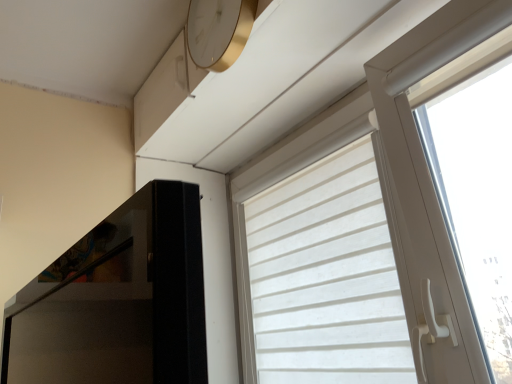
What do you see at coordinates (391, 182) in the screenshot? I see `white matte window at upper right` at bounding box center [391, 182].

What do you see at coordinates (326, 277) in the screenshot? The image size is (512, 384). I see `white fabric curtain at upper right` at bounding box center [326, 277].

The height and width of the screenshot is (384, 512). In order to click on white matte window at upper right in this screenshot , I will do `click(391, 182)`.

From a real-world perspective, is white fabric curtain at upper right on gold metallic clock at upper center?

No, from a real-world perspective, white fabric curtain at upper right is not above gold metallic clock at upper center.

Is white fabric curtain at upper right at the right side of gold metallic clock at upper center?

Correct, you'll find white fabric curtain at upper right to the right of gold metallic clock at upper center.

Which point is more forward, (x=386, y=358) or (x=197, y=61)?

The point (x=386, y=358) is in front.

Considering the sizes of objects gold metallic clock at upper center and white matte window at upper right in the image provided, who is smaller, gold metallic clock at upper center or white matte window at upper right?

Smaller between the two is gold metallic clock at upper center.

Considering the positions of objects gold metallic clock at upper center and white matte window at upper right in the image provided, who is more to the right, gold metallic clock at upper center or white matte window at upper right?

From the viewer's perspective, white matte window at upper right appears more on the right side.

Consider the image. Is gold metallic clock at upper center oriented away from white matte window at upper right?

gold metallic clock at upper center is not turned away from white matte window at upper right.

Is gold metallic clock at upper center in front of or behind white matte window at upper right in the image?

Clearly, gold metallic clock at upper center is behind white matte window at upper right.

Could you tell me if white matte window at upper right is facing white fabric curtain at upper right?

Yes, white matte window at upper right is aimed at white fabric curtain at upper right.

Considering the points (441, 90) and (373, 308), which point is in front, point (441, 90) or point (373, 308)?

Point (441, 90)

Between white matte window at upper right and white fabric curtain at upper right, which one has larger width?

white matte window at upper right is wider.

Does white matte window at upper right have a lesser height compared to white fabric curtain at upper right?

Incorrect, the height of white matte window at upper right does not fall short of that of white fabric curtain at upper right.

Is white fabric curtain at upper right positioned beyond the bounds of white matte window at upper right?

No, white fabric curtain at upper right is not entirely external to white matte window at upper right.

Looking at the image, does white fabric curtain at upper right seem bigger or smaller compared to white matte window at upper right?

white fabric curtain at upper right is smaller than white matte window at upper right.

Based on the photo, is white fabric curtain at upper right next to white matte window at upper right?

No, white fabric curtain at upper right is not touching white matte window at upper right.

Looking at this image, can you tell me how much white matte window at upper right and gold metallic clock at upper center differ in facing direction?

The angular difference between white matte window at upper right and gold metallic clock at upper center is 0.844 degrees.

Can you confirm if white matte window at upper right is shorter than gold metallic clock at upper center?

No, white matte window at upper right is not shorter than gold metallic clock at upper center.

Which object is thinner, white matte window at upper right or gold metallic clock at upper center?

gold metallic clock at upper center.

From a real-world perspective, is gold metallic clock at upper center located higher than white fabric curtain at upper right?

Yes.

Which point is more distant from viewer, (231, 34) or (311, 186)?

The point (311, 186) is more distant.

Considering the sizes of gold metallic clock at upper center and white fabric curtain at upper right in the image, is gold metallic clock at upper center taller or shorter than white fabric curtain at upper right?

Clearly, gold metallic clock at upper center is shorter compared to white fabric curtain at upper right.

Where is `clock lying above the white fabric curtain at upper right (from the image's perspective)`? clock lying above the white fabric curtain at upper right (from the image's perspective) is located at coordinates (218, 31).

Identify the location of window below the gold metallic clock at upper center (from the image's perspective). Image resolution: width=512 pixels, height=384 pixels. (391, 182).

Estimate the real-world distances between objects in this image. Which object is further from gold metallic clock at upper center, white fabric curtain at upper right or white matte window at upper right?

white fabric curtain at upper right is positioned further to the anchor gold metallic clock at upper center.

Which object lies further to the anchor point white matte window at upper right, gold metallic clock at upper center or white fabric curtain at upper right?

gold metallic clock at upper center is further to white matte window at upper right.

From the image, which object appears to be nearer to gold metallic clock at upper center, white matte window at upper right or white fabric curtain at upper right?

The object closer to gold metallic clock at upper center is white matte window at upper right.

Based on their spatial positions, is white fabric curtain at upper right or gold metallic clock at upper center further from white matte window at upper right?

gold metallic clock at upper center is further to white matte window at upper right.

Which object lies nearer to the anchor point white fabric curtain at upper right, white matte window at upper right or gold metallic clock at upper center?

Based on the image, white matte window at upper right appears to be nearer to white fabric curtain at upper right.

When comparing their distances from white fabric curtain at upper right, does gold metallic clock at upper center or white matte window at upper right seem further?

gold metallic clock at upper center lies further to white fabric curtain at upper right than the other object.

At what (x,y) coordinates should I click in order to perform the action: click on window that lies between gold metallic clock at upper center and white fabric curtain at upper right from top to bottom. Please return your answer as a coordinate pair (x, y). The width and height of the screenshot is (512, 384). Looking at the image, I should click on (391, 182).